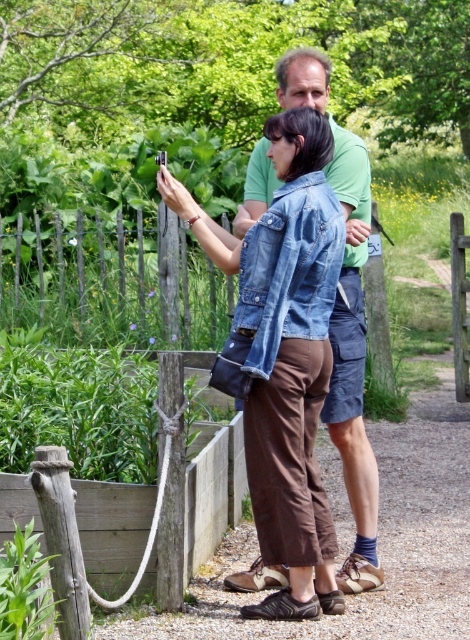
Question: Which point is closer to the camera?

Choices:
 (A) denim jacket at center
 (B) wooden fence at left

Answer: (A)

Question: Which is nearer to the wooden fence at left?

Choices:
 (A) denim jacket at lower right
 (B) denim jacket at center

Answer: (A)

Question: Is wooden fence at left positioned in front of denim jacket at lower right?

Choices:
 (A) yes
 (B) no

Answer: (B)

Question: Does wooden fence at left have a larger size compared to denim jacket at lower right?

Choices:
 (A) yes
 (B) no

Answer: (A)

Question: Where is denim jacket at lower right located in relation to denim jacket at center in the image?

Choices:
 (A) below
 (B) above

Answer: (B)

Question: Among these points, which one is farthest from the camera?

Choices:
 (A) coord(288,186)
 (B) coord(251,580)

Answer: (B)